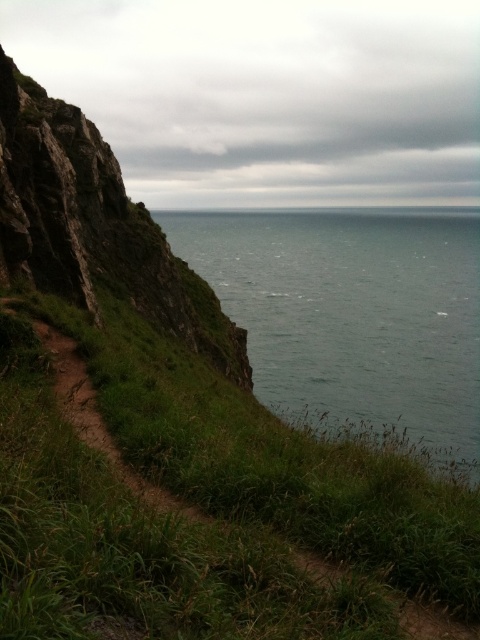
Question: Which object is positioned closest to the rough stone cliff at left?

Choices:
 (A) green grassy at lower left
 (B) greenish-blue water at center

Answer: (A)

Question: Does green grassy at lower left appear over greenish-blue water at center?

Choices:
 (A) no
 (B) yes

Answer: (A)

Question: Does green grassy at lower left appear over rough stone cliff at left?

Choices:
 (A) yes
 (B) no

Answer: (B)

Question: Which is farther from the green grassy at lower left?

Choices:
 (A) rough stone cliff at left
 (B) greenish-blue water at center

Answer: (B)

Question: Which point is closer to the camera?

Choices:
 (A) green grassy at lower left
 (B) greenish-blue water at center

Answer: (A)

Question: Is green grassy at lower left thinner than rough stone cliff at left?

Choices:
 (A) no
 (B) yes

Answer: (B)